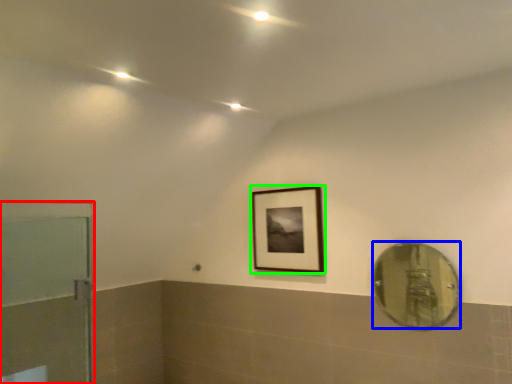
Question: Which object is positioned farthest from door (highlighted by a red box)? Select from mirror (highlighted by a blue box) and picture frame (highlighted by a green box).

Choices:
 (A) mirror
 (B) picture frame

Answer: (A)